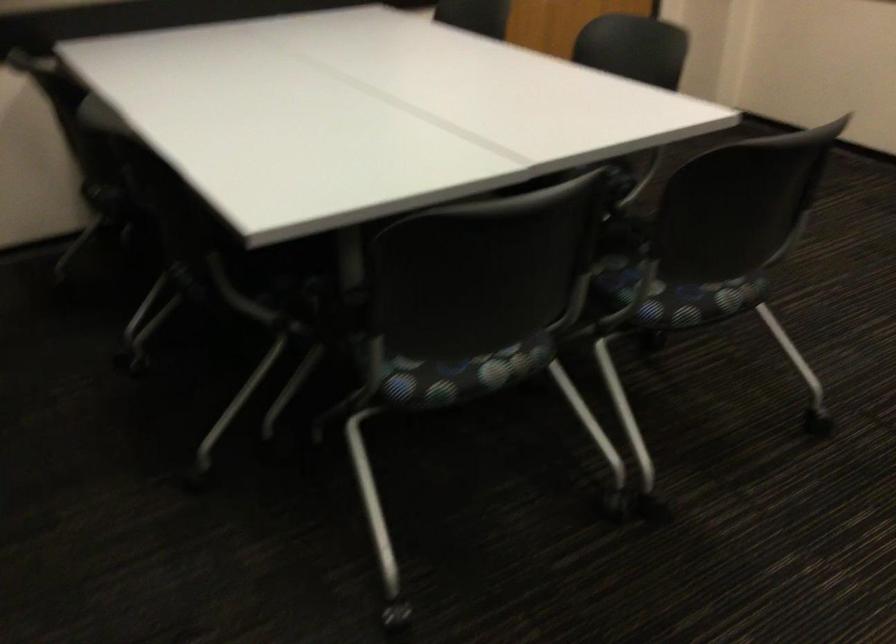
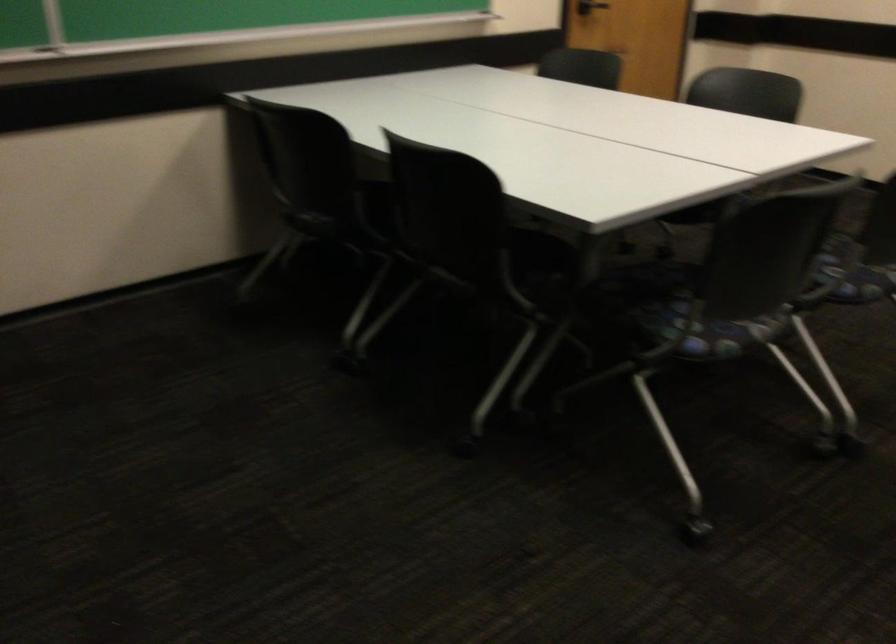
In the second image, find the point that corresponds to pixel 101 196 in the first image.

(320, 225)